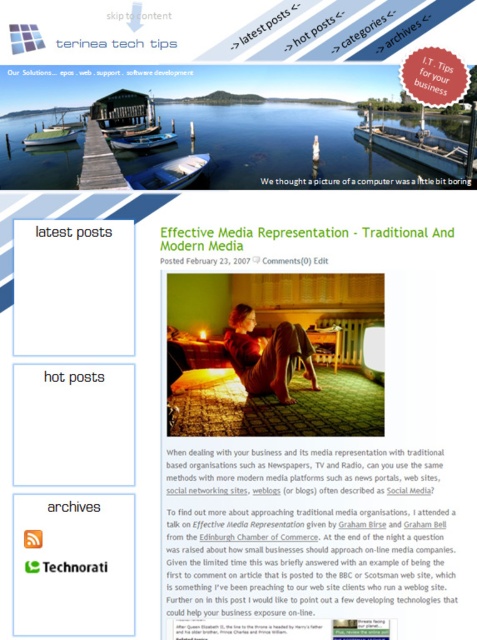
Question: Can you confirm if wooden dock at center is positioned to the left of green plastic boat at upper left?

Choices:
 (A) no
 (B) yes

Answer: (A)

Question: Which object appears closest to the camera in this image?

Choices:
 (A) green plastic boat at upper left
 (B) blue glossy boat at center
 (C) blue plastic boat at center

Answer: (B)

Question: Which object appears closest to the camera in this image?

Choices:
 (A) matte black text at upper center
 (B) blue glossy boat at center

Answer: (B)

Question: Observing the image, what is the correct spatial positioning of blue glossy boat at center in reference to matte black text at upper center?

Choices:
 (A) below
 (B) above

Answer: (B)

Question: Which point is closer to the camera?

Choices:
 (A) blue plastic boat at center
 (B) matte black text at upper center
 (C) green plastic boat at upper left
 (D) wooden dock at center

Answer: (D)

Question: Is blue glossy boat at center wider than green plastic boat at upper left?

Choices:
 (A) yes
 (B) no

Answer: (B)